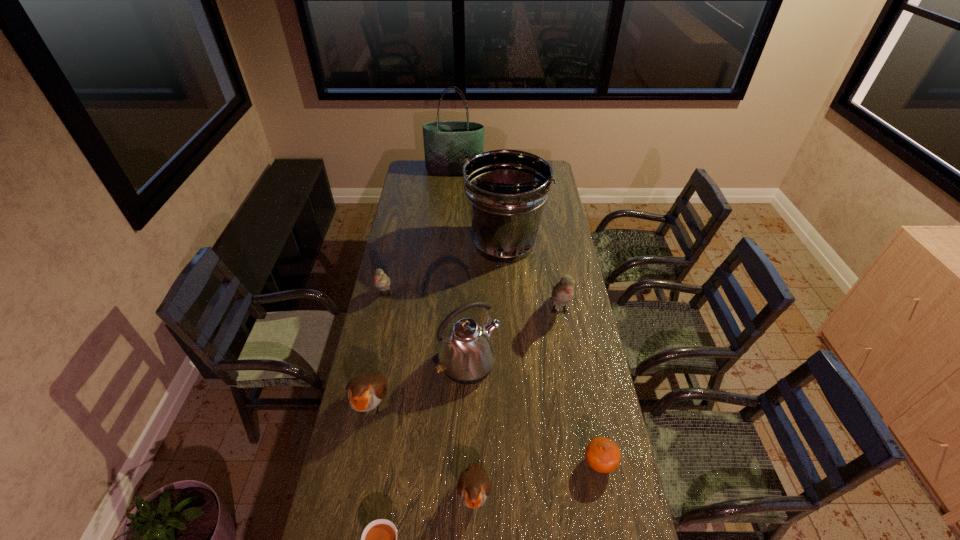
I want to click on empty space that is in between the smaller white bird and the orange orange, so 492,379.

This screenshot has height=540, width=960. Identify the location of vacant space that is in between the third tallest object and the bigger brown bird. (420, 384).

I want to click on free spot between the kettle and the second shortest object, so click(x=534, y=414).

Locate an element on the screen. The height and width of the screenshot is (540, 960). unoccupied area between the right white bird and the orange orange is located at coordinates (580, 388).

I want to click on free space between the orange and the kettle, so click(x=534, y=414).

This screenshot has height=540, width=960. I want to click on free space between the bucket and the bigger white bird, so click(531, 278).

You are a GUI agent. You are given a task and a screenshot of the screen. Output one action in this format:
    pyautogui.click(x=<x>, y=<y>)
    Task: Click on the second closest object to the second farthest object
    
    Given the screenshot: What is the action you would take?
    pyautogui.click(x=382, y=281)

You are a GUI agent. You are given a task and a screenshot of the screen. Output one action in this format:
    pyautogui.click(x=<x>, y=<y>)
    Task: Click on the object that can be found as the fifth closest to the green tote bag
    The width and height of the screenshot is (960, 540).
    Given the screenshot: What is the action you would take?
    pyautogui.click(x=364, y=393)

The height and width of the screenshot is (540, 960). I want to click on the closest bird to the green tote bag, so click(382, 281).

The height and width of the screenshot is (540, 960). What are the coordinates of `bird that can be found as the second closest to the kettle` in the screenshot? It's located at (563, 292).